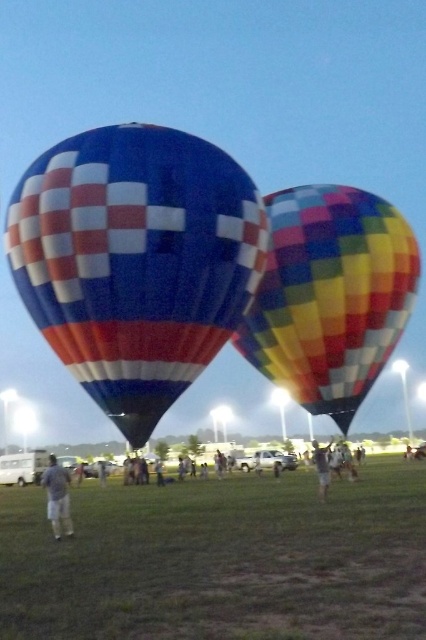
You are a photographer standing at the camera position in the scene. You want to capture a closeup shot of the multicolored checkered fabric hot air balloon at right. Given that your telephoto lens can focus on objects up to 30 meters away, will you need to move closer to the balloon to get a clear shot?

The multicolored checkered fabric hot air balloon at right is 36.50 meters away from the camera. Since the telephoto lens can only focus up to 30 meters, you will need to move closer to the balloon to get a clear shot.

You are a photographer standing in the grassy field at the hot air balloon festival. You want to capture a photo that includes both the multicolored checkered fabric hot air balloon at right and the gray fabric shorts at lower left. Which object should you frame first in your camera viewfinder to ensure both fit in the shot?

Since the multicolored checkered fabric hot air balloon at right has a lesser width compared to the gray fabric shorts at lower left, you should frame the wider gray fabric shorts at lower left first to ensure both objects fit within the camera viewfinder.

You are standing in the field and see the green grass at lower center and the light blue fabric shirt at center. Which object covers a larger area?

The green grass at lower center is bigger than the light blue fabric shirt at center, so it covers a larger area.